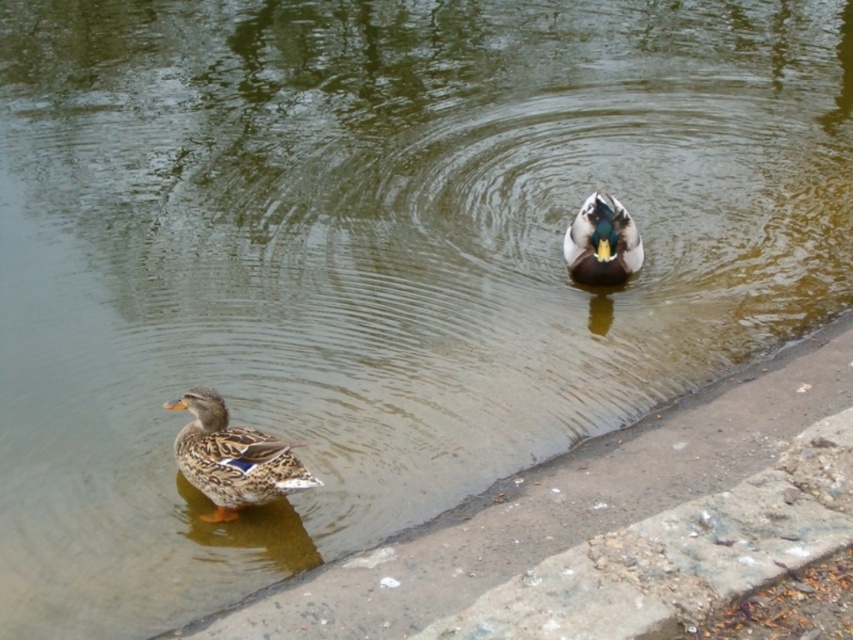
You are standing at the edge of the pond and want to throw a pebble to hit the point marked at coordinates point [199,515]. If your maximum throwing distance is 5 meters, will you be able to reach that point?

The point marked at coordinates point [199,515] is 4.62 meters away from the viewer. Since your maximum throwing distance is 5 meters, you can reach the point.

You are a birdwatcher observing the ducks in the pond. You notice the brown speckled feathers duck at lower left and the shiny green duck at center. Which duck is closer to the surface of the water?

The shiny green duck at center is closer to the surface of the water because the brown speckled feathers duck at lower left is positioned under it.